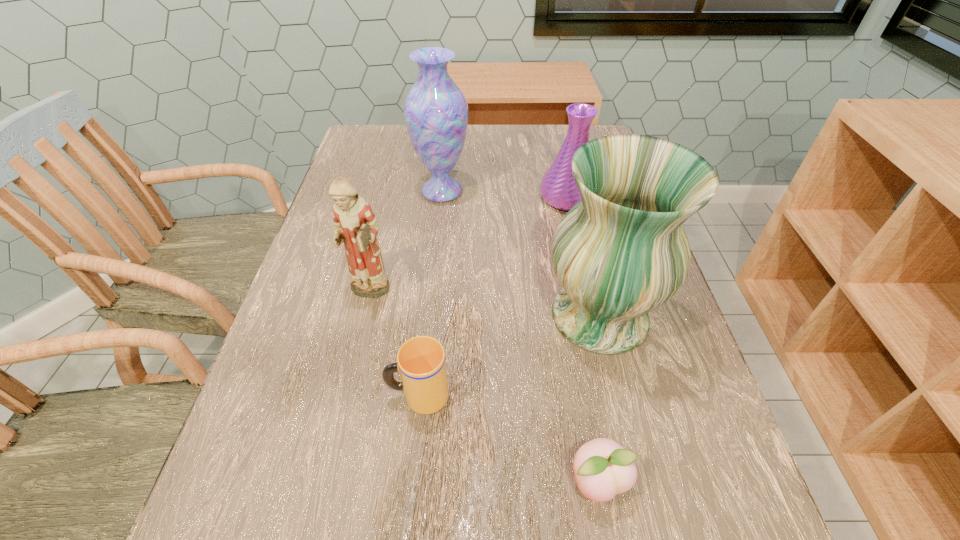
This screenshot has width=960, height=540. I want to click on blank space located on the front-facing side of the leftmost object, so click(x=348, y=383).

This screenshot has width=960, height=540. I want to click on free space located on the left of the shortest vase, so click(x=398, y=198).

I want to click on free space located on the side of the second nearest object with the handle, so click(260, 396).

Where is `vacant space located on the side of the second nearest object with the handle`? Image resolution: width=960 pixels, height=540 pixels. vacant space located on the side of the second nearest object with the handle is located at coordinates (336, 396).

The image size is (960, 540). I want to click on vacant space located on the side of the second nearest object with the handle, so click(x=300, y=396).

Locate an element on the screen. The height and width of the screenshot is (540, 960). vacant space located 0.280m on the left of the peach is located at coordinates (381, 483).

I want to click on object that is at the left edge, so click(x=355, y=224).

In the image, there is a desktop. At what (x,y) coordinates should I click in order to perform the action: click on vacant space at the far edge. Please return your answer as a coordinate pair (x, y). Looking at the image, I should click on (525, 164).

The width and height of the screenshot is (960, 540). Identify the location of free space at the left edge. (x=293, y=458).

Find the location of `free region at the right edge of the desktop`. free region at the right edge of the desktop is located at coordinates click(666, 398).